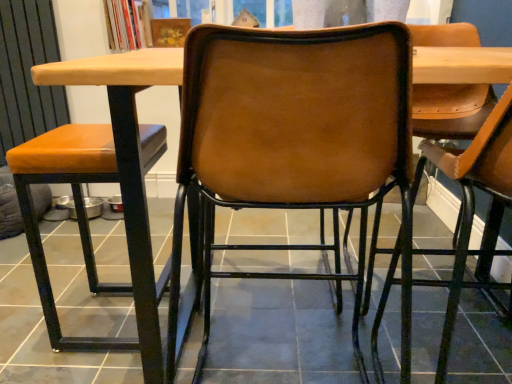
Locate an element on the screen. blank space situated above orange leather stool at left, the 3th chair viewed from the right (from a real-world perspective) is located at coordinates (76, 135).